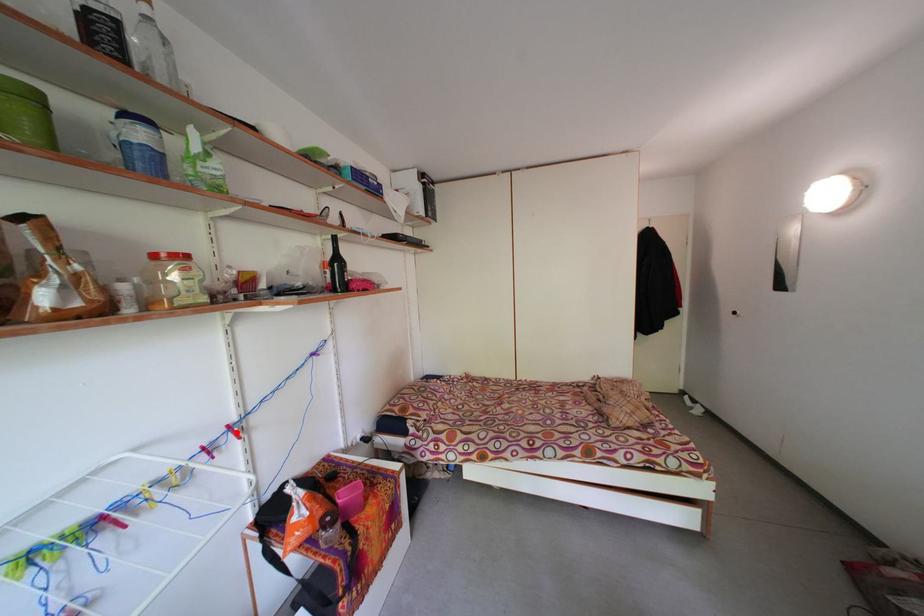
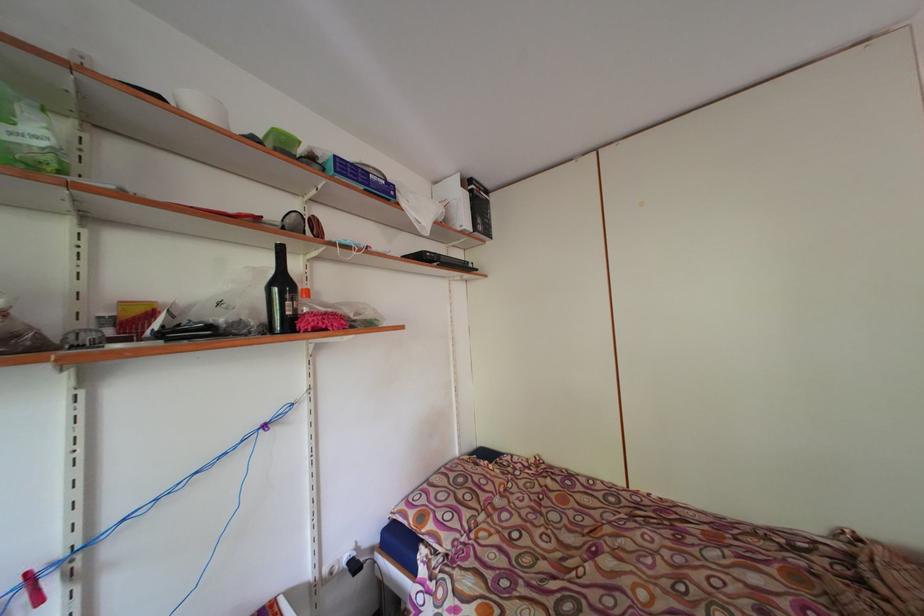
Question: I am providing you with two images of the same scene from different viewpoints. Given a red point in image1, look at the same physical point in image2. Is it:

Choices:
 (A) Closer to the viewpoint
 (B) Farther from the viewpoint

Answer: (A)